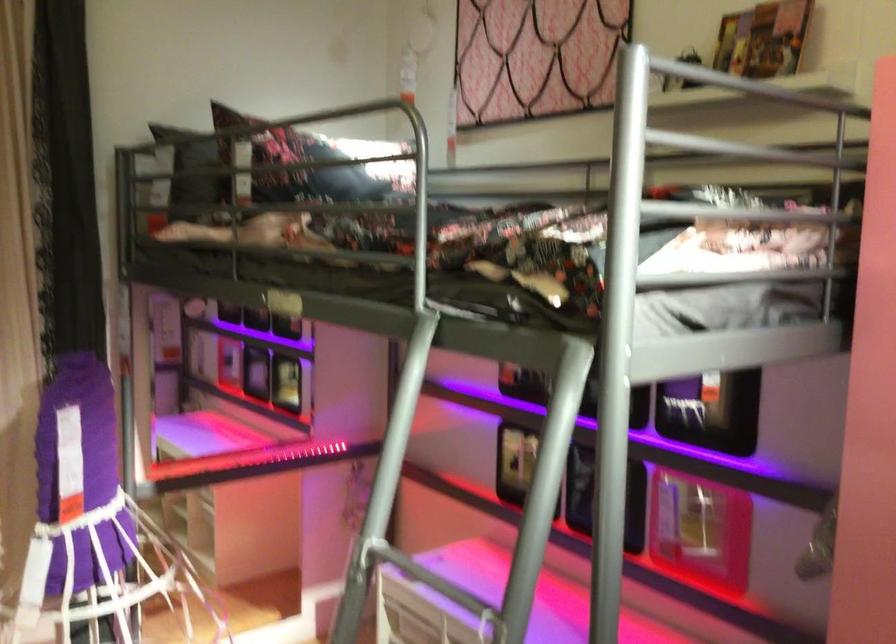
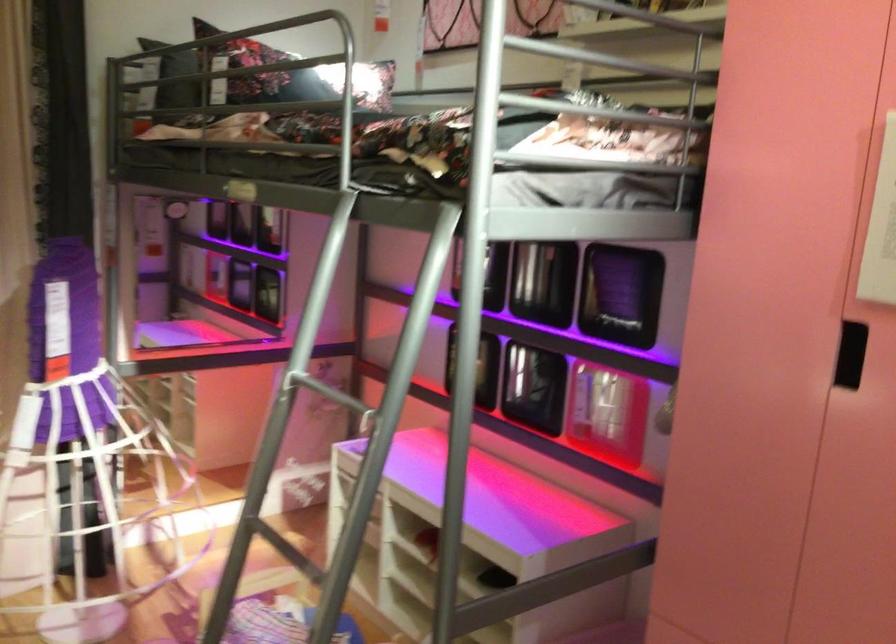
Where in the second image is the point corresponding to point 392,411 from the first image?

(316, 270)